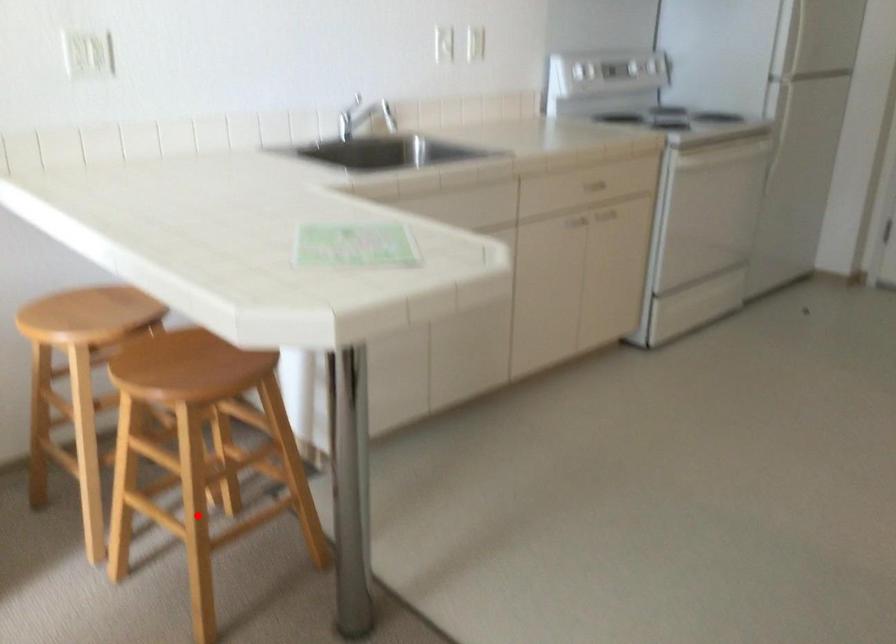
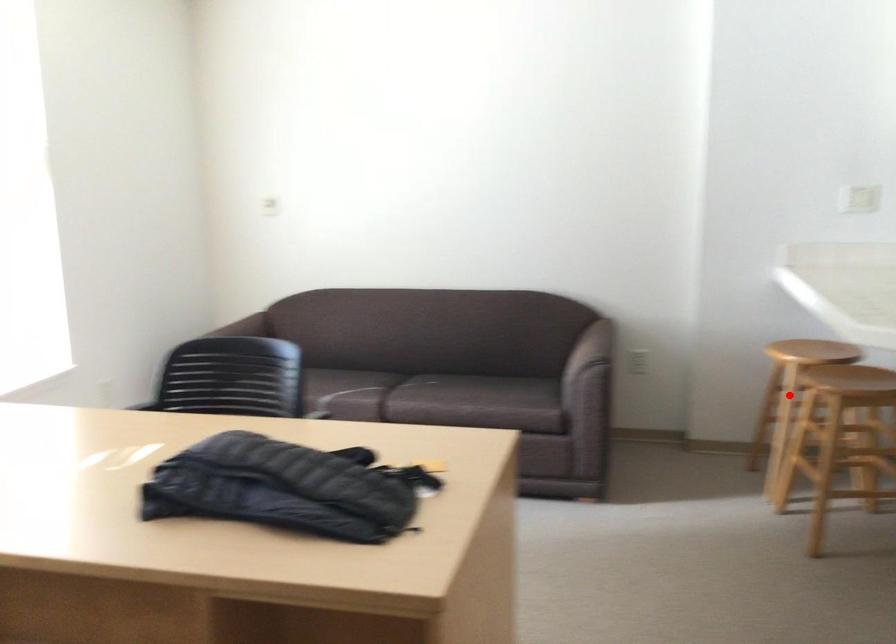
Consider the image. I am providing you with two images of the same scene from different viewpoints. A red point is marked on the first image and another point is marked on the second image. Is the marked point in image1 the same physical position as the marked point in image2?

No